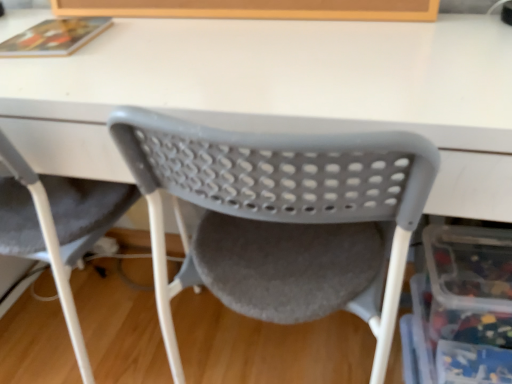
Find the location of a particular element. vacant space in gray plastic chair at lower left, marked as the second chair in a right-to-left arrangement (from a real-world perspective) is located at coordinates (97, 331).